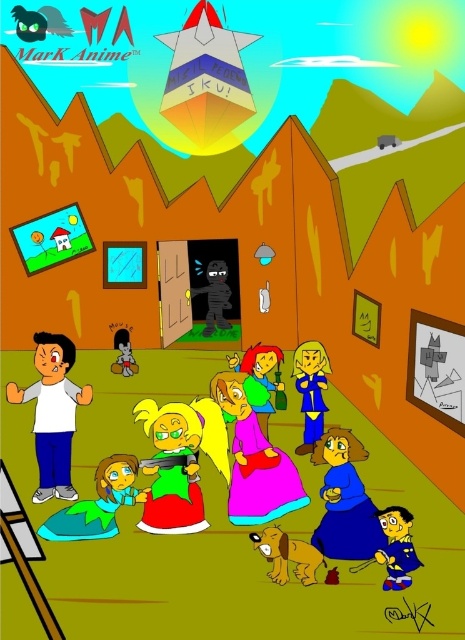
You are a character in the scene and want to place a gift for the ghostly figure inside the house. The gift is a metallic silver pyramid at center and a smooth brown doll at center. Since you want to give them in the order you see them from left to right, which one should you give first?

The smooth brown doll at center should be given first because the metallic silver pyramid at center is positioned on the right side of it, meaning the smooth brown doll at center is on the left.

You are standing at the entrance of the house and see the point marked at coordinate [254,458]. What object is located at that point?

The point at coordinate [254,458] marks the silky pink dress at center.

From the picture: You are standing in front of the house and notice two points marked in the scene. Which point, point (317, 358) or point (280, 362), is closer to you?

Point (317, 358) is closer to the viewer than point (280, 362).